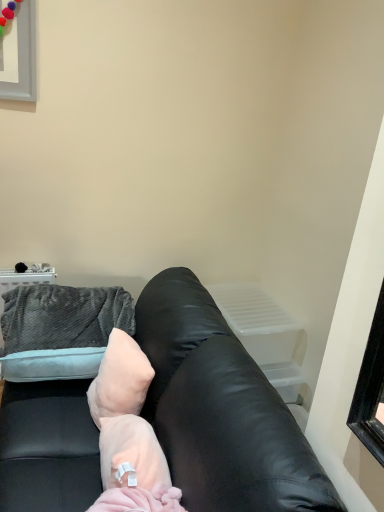
Describe the element at coordinates (60, 330) in the screenshot. I see `velvety gray throw pillow at upper left` at that location.

Find the location of a particular element. This screenshot has height=512, width=384. velvety gray throw pillow at upper left is located at coordinates (60, 330).

Describe the element at coordinates (128, 433) in the screenshot. I see `pink fluffy blanket at center` at that location.

Where is `black leather couch at center`? This screenshot has width=384, height=512. black leather couch at center is located at coordinates (221, 410).

Where is `velvety gray throw pillow at upper left`? velvety gray throw pillow at upper left is located at coordinates (60, 330).

Does velvety gray throw pillow at upper left have a lesser width compared to pale pink plush pillow at center?

No, velvety gray throw pillow at upper left is not thinner than pale pink plush pillow at center.

In the scene shown: How many degrees apart are the facing directions of velvety gray throw pillow at upper left and pale pink plush pillow at center?

velvety gray throw pillow at upper left and pale pink plush pillow at center are facing 15.6 degrees away from each other.

The image size is (384, 512). What are the coordinates of `throw pillow above the pale pink plush pillow at center (from the image's perspective)` in the screenshot? It's located at (60, 330).

Is black leather couch at center far away from velvety gray throw pillow at upper left?

No.

Which of these two, black leather couch at center or velvety gray throw pillow at upper left, stands taller?

black leather couch at center is taller.

How far apart are black leather couch at center and velvety gray throw pillow at upper left?

They are 16.21 inches apart.

From a real-world perspective, between black leather couch at center and pink fluffy blanket at center, who is vertically higher?

pink fluffy blanket at center, from a real-world perspective.

Can you confirm if black leather couch at center is thinner than pink fluffy blanket at center?

No, black leather couch at center is not thinner than pink fluffy blanket at center.

Which of these two, black leather couch at center or pink fluffy blanket at center, stands shorter?

pink fluffy blanket at center.

Considering the positions of point (321, 486) and point (106, 490), is point (321, 486) closer or farther from the camera than point (106, 490)?

Clearly, point (321, 486) is closer to the camera than point (106, 490).

Is pink fluffy blanket at center in front of or behind black leather couch at center in the image?

Clearly, pink fluffy blanket at center is behind black leather couch at center.

Locate an element on the screen. newborn above the black leather couch at center (from the image's perspective) is located at coordinates (128, 433).

Does pink fluffy blanket at center have a lesser height compared to black leather couch at center?

Yes.

Does point (134, 347) appear closer or farther from the camera than point (20, 445)?

Point (134, 347).

How much distance is there between velvety gray throw pillow at upper left and pink fluffy blanket at center?

They are 12.22 inches apart.

From the image's perspective, relative to pink fluffy blanket at center, is velvety gray throw pillow at upper left above or below?

Clearly, from the image's perspective, velvety gray throw pillow at upper left is above pink fluffy blanket at center.

What's the angular difference between velvety gray throw pillow at upper left and pink fluffy blanket at center's facing directions?

3.14 degrees.

Is point (126, 297) closer or farther from the camera than point (99, 414)?

Point (126, 297) is farther from the camera than point (99, 414).

Which is nearer, (x=144, y=370) or (x=94, y=361)?

The point (x=144, y=370) is closer to the camera.

Is pale pink plush pillow at center turned away from velvety gray throw pillow at upper left?

No.

Looking at this image, how far apart are pale pink plush pillow at center and velvety gray throw pillow at upper left?

pale pink plush pillow at center is 9.32 inches away from velvety gray throw pillow at upper left.

Considering the sizes of objects pale pink plush pillow at center and velvety gray throw pillow at upper left in the image provided, who is shorter, pale pink plush pillow at center or velvety gray throw pillow at upper left?

With less height is pale pink plush pillow at center.

Based on their sizes in the image, would you say pink fluffy blanket at center is bigger or smaller than pale pink plush pillow at center?

pink fluffy blanket at center is bigger than pale pink plush pillow at center.

Is pale pink plush pillow at center at the back of pink fluffy blanket at center?

No, pink fluffy blanket at center is not facing away from pale pink plush pillow at center.

What's the angular difference between pink fluffy blanket at center and pale pink plush pillow at center's facing directions?

The facing directions of pink fluffy blanket at center and pale pink plush pillow at center are 18.7 degrees apart.

Is pink fluffy blanket at center placed right next to pale pink plush pillow at center?

Yes, pink fluffy blanket at center is right next to pale pink plush pillow at center and making contact.

Find the location of `pillow on the right of velvety gray throw pillow at upper left`. pillow on the right of velvety gray throw pillow at upper left is located at coordinates (120, 379).

There is a black leather couch at center. Where is `throw pillow above it (from a real-world perspective)`? The width and height of the screenshot is (384, 512). throw pillow above it (from a real-world perspective) is located at coordinates (60, 330).

Estimate the real-world distances between objects in this image. Which object is closer to velvety gray throw pillow at upper left, black leather couch at center or pale pink plush pillow at center?

pale pink plush pillow at center is closer to velvety gray throw pillow at upper left.

When comparing their distances from pale pink plush pillow at center, does velvety gray throw pillow at upper left or black leather couch at center seem further?

velvety gray throw pillow at upper left is further to pale pink plush pillow at center.

When comparing their distances from velvety gray throw pillow at upper left, does pink fluffy blanket at center or black leather couch at center seem closer?

Based on the image, pink fluffy blanket at center appears to be nearer to velvety gray throw pillow at upper left.

When comparing their distances from pale pink plush pillow at center, does black leather couch at center or pink fluffy blanket at center seem further?

black leather couch at center.

Considering their positions, is black leather couch at center positioned closer to velvety gray throw pillow at upper left than pink fluffy blanket at center?

pink fluffy blanket at center lies closer to velvety gray throw pillow at upper left than the other object.

Which object lies further to the anchor point black leather couch at center, pale pink plush pillow at center or velvety gray throw pillow at upper left?

Among the two, velvety gray throw pillow at upper left is located further to black leather couch at center.

Which object lies nearer to the anchor point pink fluffy blanket at center, black leather couch at center or velvety gray throw pillow at upper left?

The object closer to pink fluffy blanket at center is black leather couch at center.

When comparing their distances from black leather couch at center, does velvety gray throw pillow at upper left or pale pink plush pillow at center seem closer?

pale pink plush pillow at center lies closer to black leather couch at center than the other object.

Where is `newborn positioned between black leather couch at center and velvety gray throw pillow at upper left from near to far`? newborn positioned between black leather couch at center and velvety gray throw pillow at upper left from near to far is located at coordinates (128, 433).

Find the location of a particular element. Image resolution: width=384 pixels, height=512 pixels. pillow located between black leather couch at center and velvety gray throw pillow at upper left in the depth direction is located at coordinates (120, 379).

The width and height of the screenshot is (384, 512). In order to click on newborn located between black leather couch at center and pale pink plush pillow at center in the depth direction in this screenshot , I will do `click(128, 433)`.

Where is `pillow between pink fluffy blanket at center and velvety gray throw pillow at upper left in the front-back direction`? This screenshot has width=384, height=512. pillow between pink fluffy blanket at center and velvety gray throw pillow at upper left in the front-back direction is located at coordinates (120, 379).